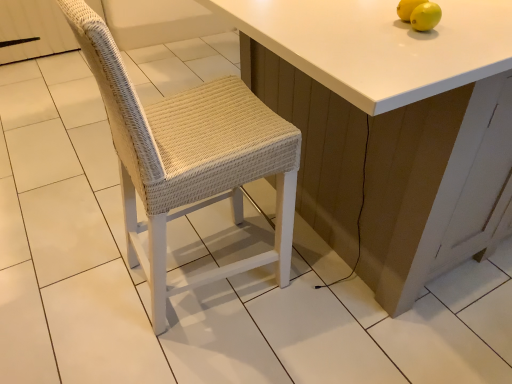
What do you see at coordinates (391, 127) in the screenshot? I see `white glossy table at center` at bounding box center [391, 127].

At what (x,y) coordinates should I click in order to perform the action: click on white glossy table at center. Please return your answer as a coordinate pair (x, y). The height and width of the screenshot is (384, 512). Looking at the image, I should click on (391, 127).

The image size is (512, 384). In order to click on white glossy table at center in this screenshot , I will do `click(391, 127)`.